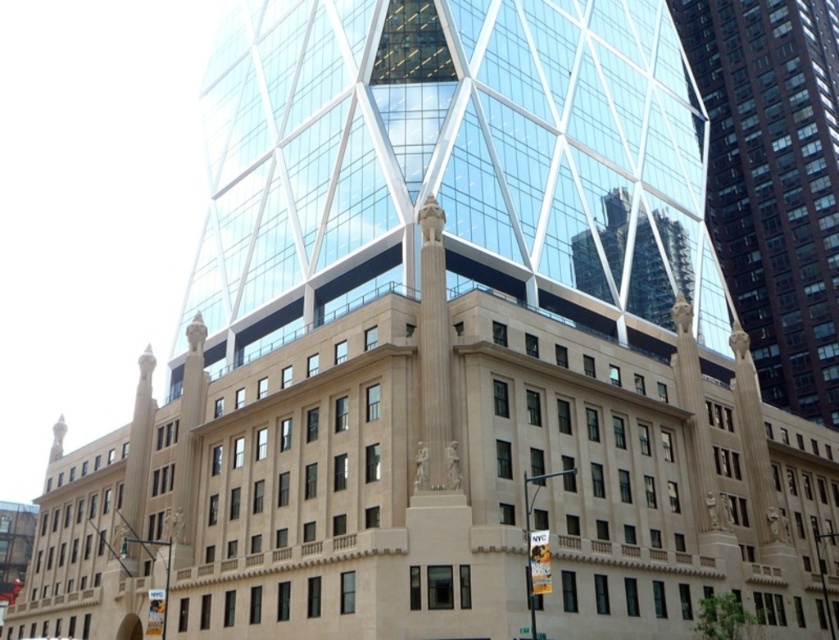
Does brown glass building at center appear on the left side of metallic silver car at center?

In fact, brown glass building at center is to the right of metallic silver car at center.

You are a GUI agent. You are given a task and a screenshot of the screen. Output one action in this format:
    pyautogui.click(x=<x>, y=<y>)
    Task: Click on the brown glass building at center
    
    Given the screenshot: What is the action you would take?
    pyautogui.click(x=774, y=180)

The image size is (839, 640). Describe the element at coordinates (774, 180) in the screenshot. I see `brown glass building at center` at that location.

Image resolution: width=839 pixels, height=640 pixels. What are the coordinates of `brown glass building at center` in the screenshot? It's located at [x=774, y=180].